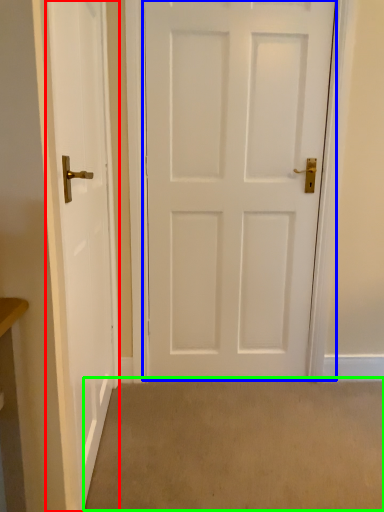
Question: Estimate the real-world distances between objects in this image. Which object is farther from door (highlighted by a red box), door (highlighted by a blue box) or plain (highlighted by a green box)?

Choices:
 (A) door
 (B) plain

Answer: (B)